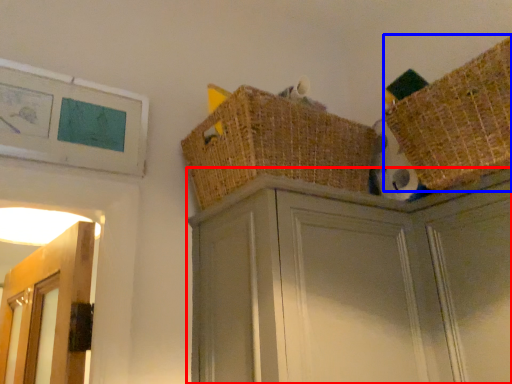
Question: Which object appears closest to the camera in this image, cabinetry (highlighted by a red box) or basket (highlighted by a blue box)?

Choices:
 (A) cabinetry
 (B) basket

Answer: (A)